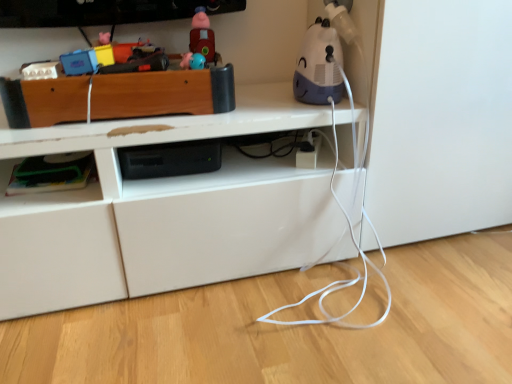
Question: Is green plastic container at lower left, marked as the second shelf in a top-to-bottom arrangement, in front of or behind wooden toy box at upper left, the first shelf in the top-to-bottom sequence, in the image?

Choices:
 (A) behind
 (B) front

Answer: (A)

Question: In terms of height, does green plastic container at lower left, which is the 1th shelf from bottom to top, look taller or shorter compared to wooden toy box at upper left, the first shelf in the top-to-bottom sequence?

Choices:
 (A) tall
 (B) short

Answer: (B)

Question: Which object is positioned closest to the green plastic container at lower left, which is the 1th shelf from bottom to top?

Choices:
 (A) rubberized red train at upper center, marked as the second toy in a right-to-left arrangement
 (B) wooden toy box at upper left, which is the 2th shelf in bottom-to-top order
 (C) white plastic humidifier at upper right, which ranks as the 2th toy in left-to-right order

Answer: (B)

Question: Which of these objects is positioned closest to the wooden toy box at upper left, the first shelf in the top-to-bottom sequence?

Choices:
 (A) green plastic container at lower left, which is the 1th shelf from bottom to top
 (B) rubberized red train at upper center, which ranks as the first toy in left-to-right order
 (C) white plastic humidifier at upper right, which ranks as the 2th toy in left-to-right order

Answer: (A)